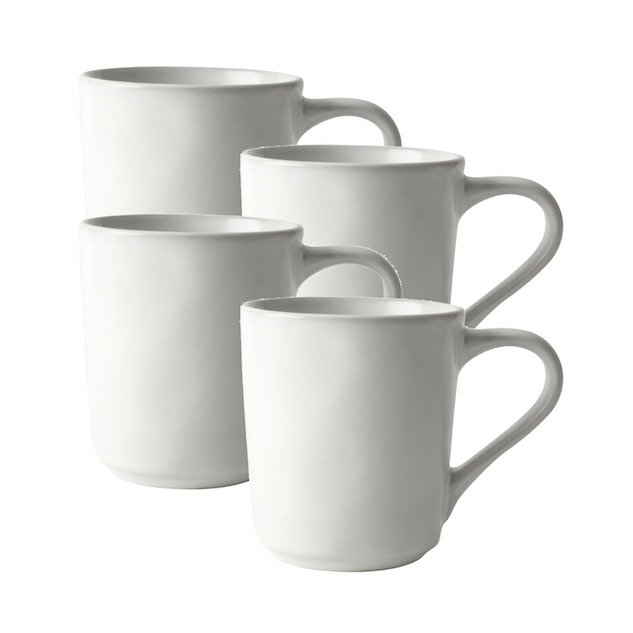
Where is `cup handles`? cup handles is located at coordinates (549, 204), (348, 107), (373, 257), (549, 363).